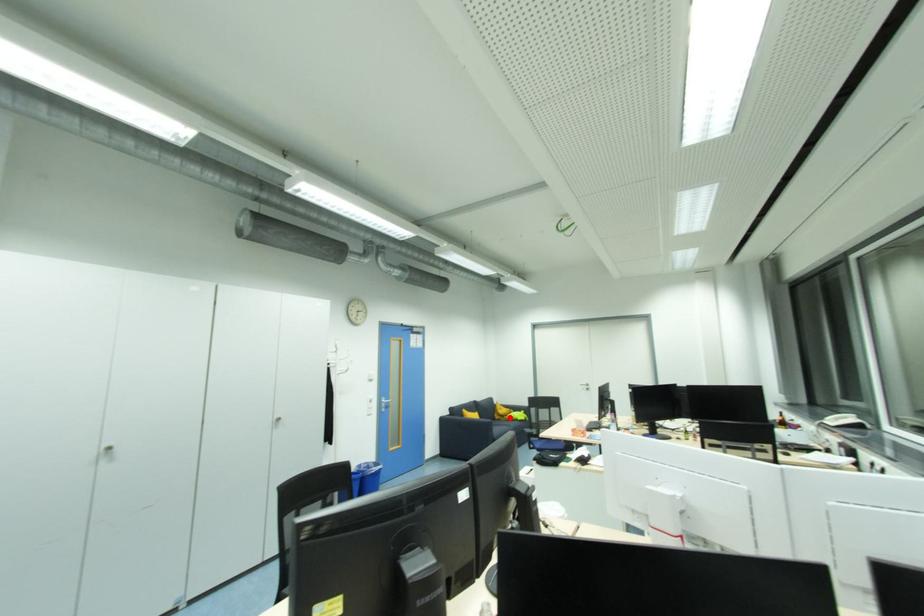
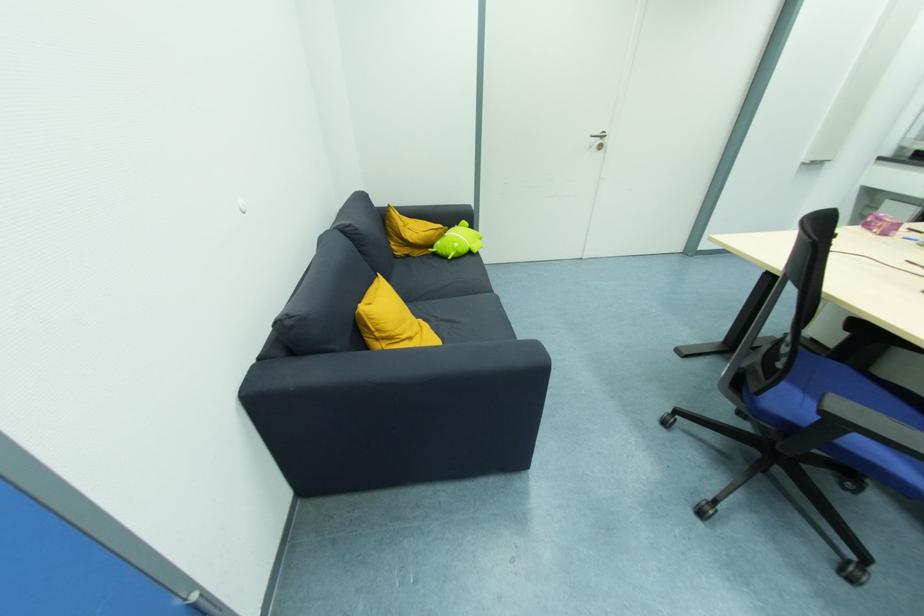
Question: I am providing you with two images of the same scene from different viewpoints. In image1, a red point is highlighted. Considering the same 3D point in image2, which of the following is correct?

Choices:
 (A) It is closer
 (B) It is farther

Answer: (A)